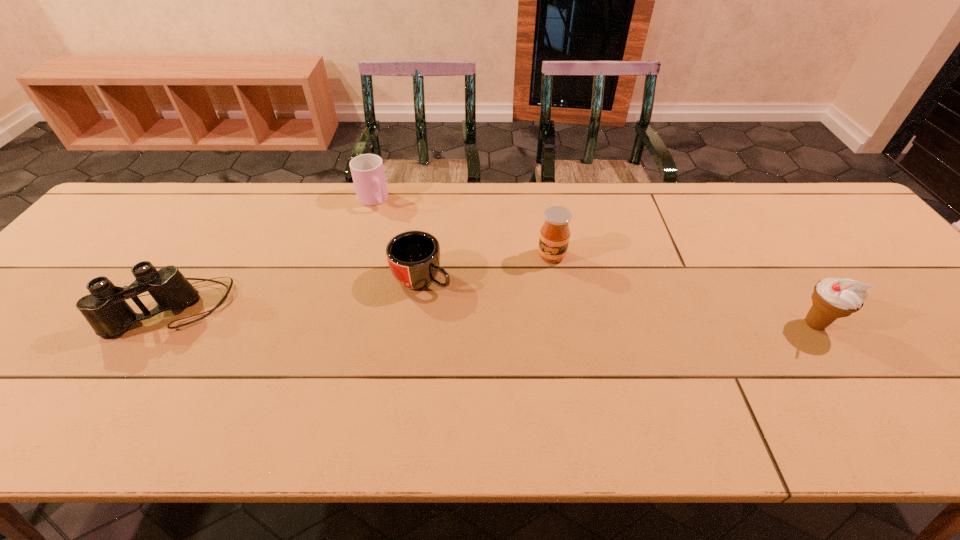
Locate an element on the screen. The width and height of the screenshot is (960, 540). vacant area at the near edge of the desktop is located at coordinates (793, 362).

Image resolution: width=960 pixels, height=540 pixels. I want to click on vacant region at the right edge of the desktop, so click(946, 333).

The image size is (960, 540). In the image, there is a desktop. Find the location of `vacant region at the far left corner`. vacant region at the far left corner is located at coordinates pos(134,207).

The height and width of the screenshot is (540, 960). What are the coordinates of `vacant area at the near right corner of the desktop` in the screenshot? It's located at (958, 388).

The width and height of the screenshot is (960, 540). Identify the location of free space that is in between the honey and the binoculars. (362, 282).

Where is `vacant area that lies between the honey and the binoculars`? This screenshot has height=540, width=960. vacant area that lies between the honey and the binoculars is located at coordinates (362, 282).

Locate an element on the screen. The width and height of the screenshot is (960, 540). free spot between the leftmost object and the fourth object from left to right is located at coordinates (362, 282).

Where is `free space between the leftmost object and the third object from left to right`? The image size is (960, 540). free space between the leftmost object and the third object from left to right is located at coordinates pyautogui.click(x=297, y=293).

You are a GUI agent. You are given a task and a screenshot of the screen. Output one action in this format:
    pyautogui.click(x=<x>, y=<y>)
    Task: Click on the blank region between the cup and the binoculars
    
    Given the screenshot: What is the action you would take?
    pyautogui.click(x=273, y=254)

I want to click on vacant area between the binoculars and the mug, so click(x=297, y=293).